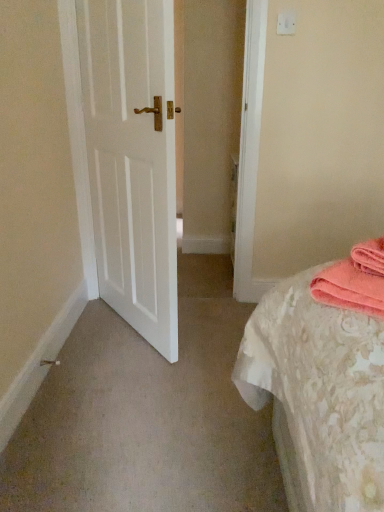
Question: Is white plastic light switch at upper center wider or thinner than white matte door at left?

Choices:
 (A) thin
 (B) wide

Answer: (A)

Question: Relative to white matte door at left, is white plastic light switch at upper center in front or behind?

Choices:
 (A) front
 (B) behind

Answer: (B)

Question: Estimate the real-world distances between objects in this image. Which object is closer to the white plastic light switch at upper center?

Choices:
 (A) pink towel at right
 (B) white matte door at left

Answer: (B)

Question: Estimate the real-world distances between objects in this image. Which object is farther from the white plastic light switch at upper center?

Choices:
 (A) pink towel at right
 (B) white matte door at left

Answer: (A)